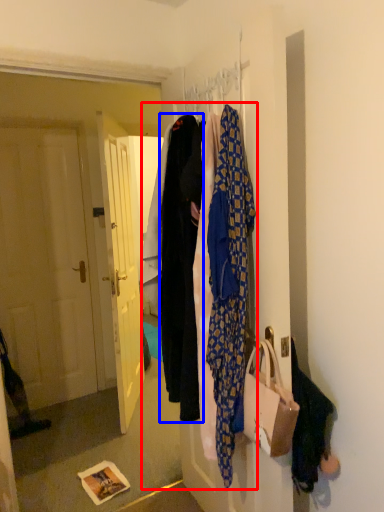
Question: Which point is further to the camera, closet (highlighted by a red box) or garment (highlighted by a blue box)?

Choices:
 (A) closet
 (B) garment

Answer: (B)